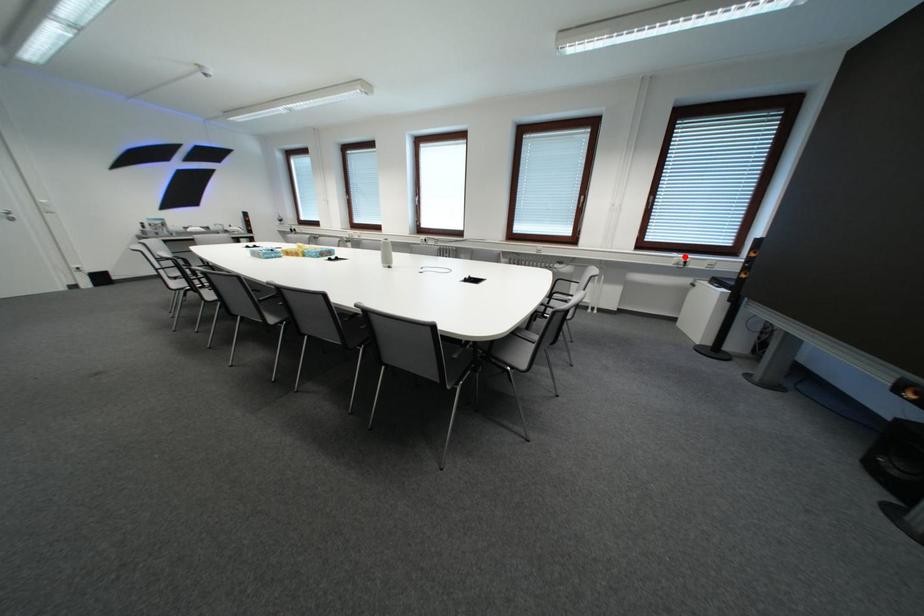
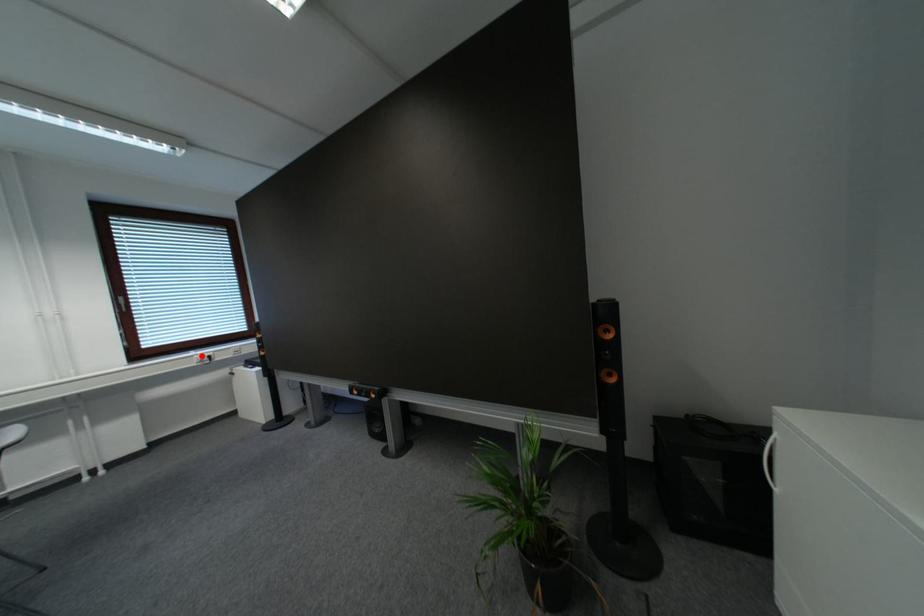
I am providing you with two images of the same scene from different viewpoints. A red point is marked on the first image and another point is marked on the second image. Is the marked point in image1 the same physical position as the marked point in image2?

Yes